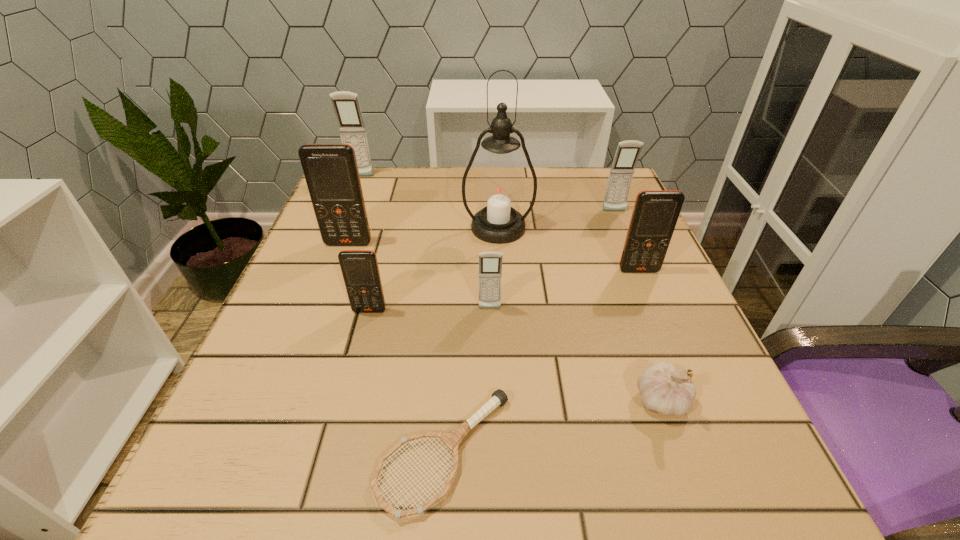
You are a GUI agent. You are given a task and a screenshot of the screen. Output one action in this format:
    pyautogui.click(x=<x>, y=<y>)
    Task: Click on the orange cellular telephone that is the second nearest to the second orange cellular telephone from right to left
    Image resolution: width=960 pixels, height=540 pixels.
    Given the screenshot: What is the action you would take?
    pyautogui.click(x=655, y=214)

Find the location of `vacant space that satisfies the following two spatial constraints: 1. on the front-facing side of the smallest gray cellular telephone; 2. on the right side of the second shortest object`. vacant space that satisfies the following two spatial constraints: 1. on the front-facing side of the smallest gray cellular telephone; 2. on the right side of the second shortest object is located at coordinates (492, 399).

In order to click on free space that satisfies the following two spatial constraints: 1. on the front-facing side of the fourth cellular telephone from left to right; 2. on the right side of the garlic in this screenshot , I will do coord(492,399).

Identify the location of vacant area that satisfies the following two spatial constraints: 1. on the front-facing side of the garlic; 2. on the right side of the farthest cellular telephone. This screenshot has width=960, height=540. point(267,399).